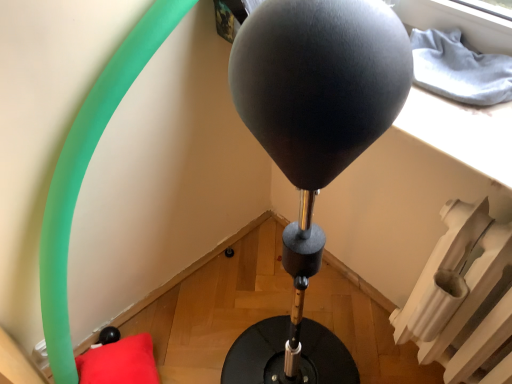
At what (x,y) coordinates should I click in order to perform the action: click on free space above red plush pillow at lower left (from a real-world perspective). Please return your answer as a coordinate pair (x, y). Looking at the image, I should click on (115, 364).